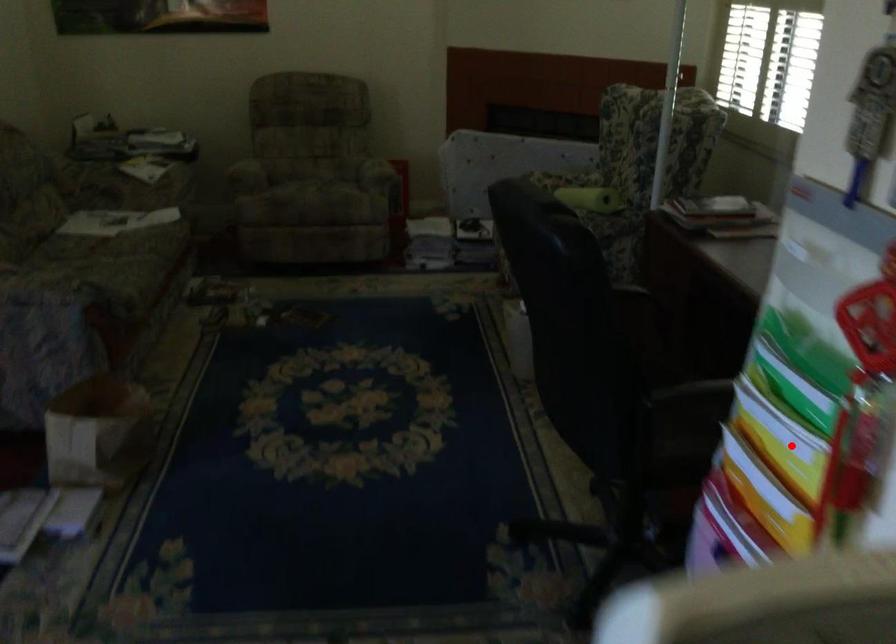
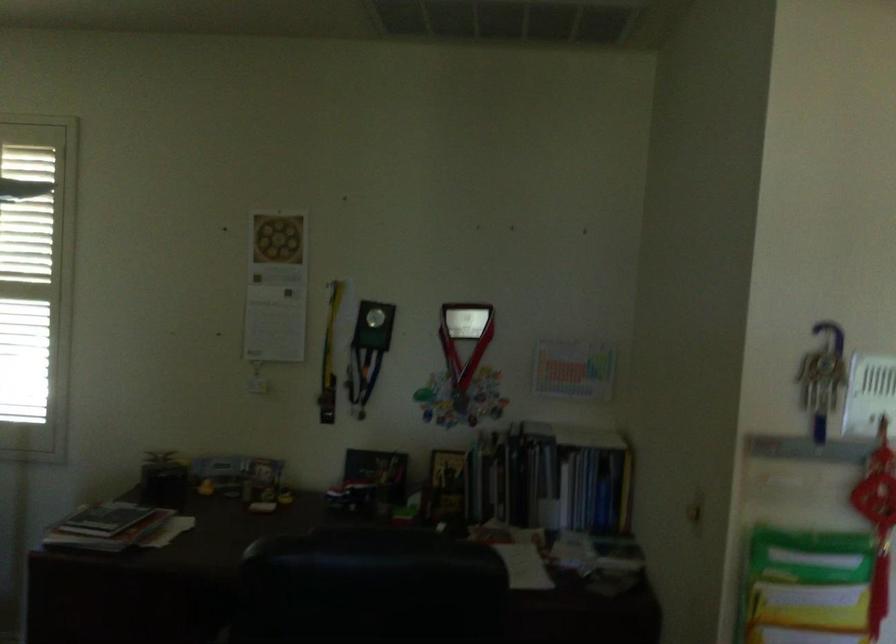
Find the pixel in the second image that matches the highlighted location in the first image.

(812, 614)